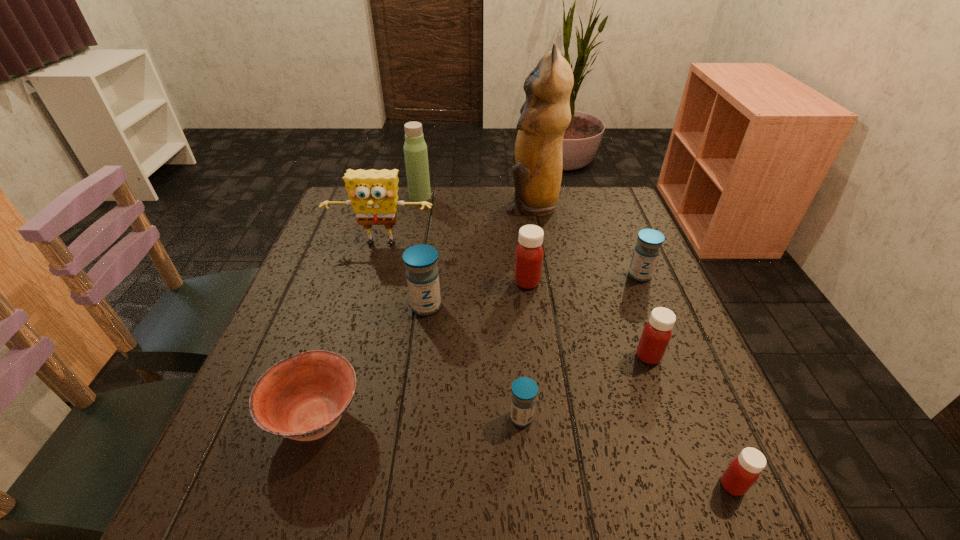
Image resolution: width=960 pixels, height=540 pixels. Identify the location of vacant space located 0.140m on the front of the thermos bottle. (414, 228).

Locate an element on the screen. The width and height of the screenshot is (960, 540). free space located 0.110m on the face of the yellow sponge is located at coordinates (371, 283).

Locate an element on the screen. vacant space located 0.160m on the back of the leftmost red medicine is located at coordinates (521, 235).

In order to click on vacant space located 0.320m on the right of the biggest blue medicine in this screenshot , I will do `click(582, 306)`.

Where is `vacant space located 0.320m on the left of the rightmost blue medicine`? This screenshot has width=960, height=540. vacant space located 0.320m on the left of the rightmost blue medicine is located at coordinates (498, 275).

Find the location of a particular element. This screenshot has width=960, height=540. vacant region located on the left of the second farthest red medicine is located at coordinates (528, 356).

Find the location of `free space located on the back of the bowl`. free space located on the back of the bowl is located at coordinates (336, 355).

You are a GUI agent. You are given a task and a screenshot of the screen. Output one action in this format:
    pyautogui.click(x=<x>, y=<y>)
    Task: Click on the vacant position located on the right of the second blue medicine from right to left
    The width and height of the screenshot is (960, 540).
    Given the screenshot: What is the action you would take?
    pyautogui.click(x=617, y=417)

Locate an element on the screen. The image size is (960, 540). free space located 0.290m on the left of the nearest object is located at coordinates (539, 485).

The height and width of the screenshot is (540, 960). I want to click on cat located in the far edge section of the desktop, so click(x=545, y=115).